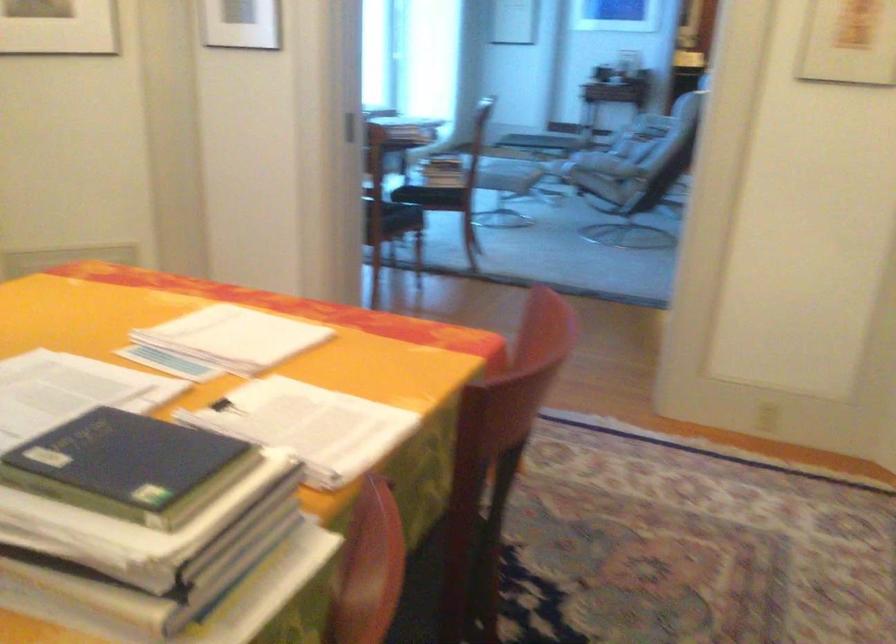
The width and height of the screenshot is (896, 644). I want to click on dark blue book, so click(x=128, y=466).